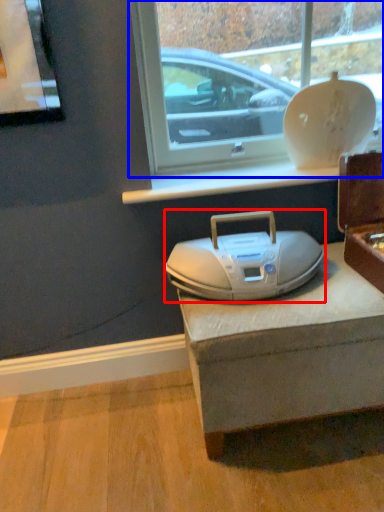
Question: Which of the following is the closest to the observer, appliance (highlighted by a red box) or window (highlighted by a blue box)?

Choices:
 (A) appliance
 (B) window

Answer: (A)